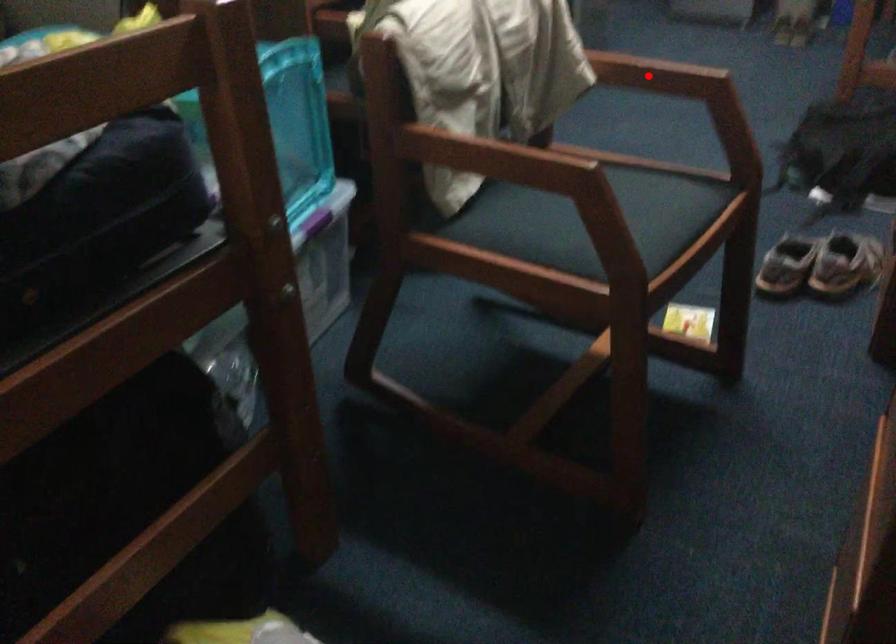
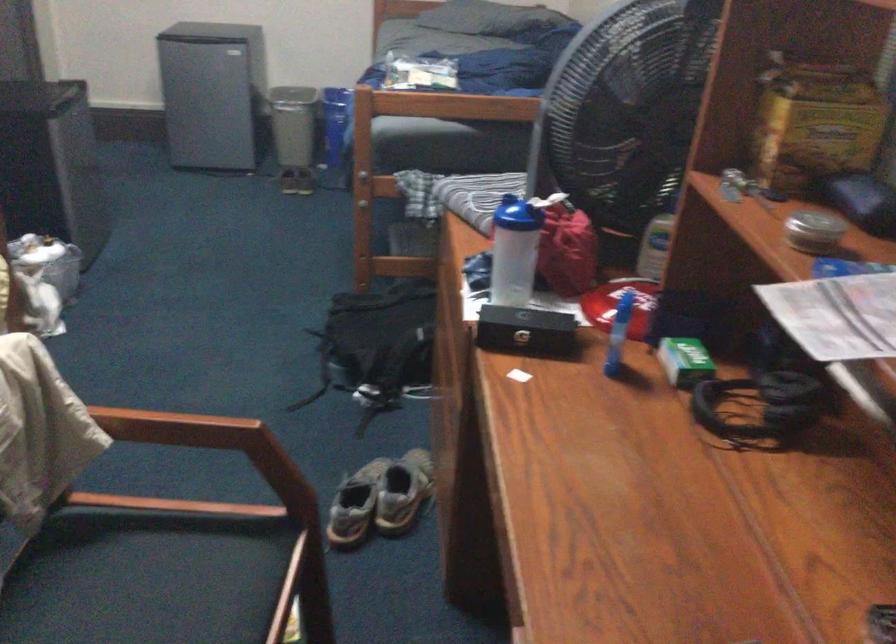
Question: I am providing you with two images of the same scene from different viewpoints. Given a red point in image1, look at the same physical point in image2. Is it:

Choices:
 (A) Closer to the viewpoint
 (B) Farther from the viewpoint

Answer: (A)